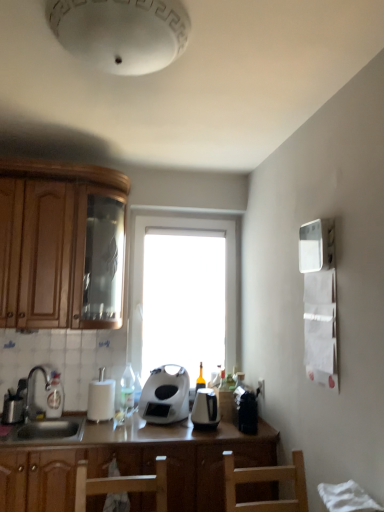
Question: Would you say white glossy bottle at center, which is the second bottle from left to right, is inside or outside transparent glass window at center?

Choices:
 (A) outside
 (B) inside

Answer: (A)

Question: Is point (132, 373) closer or farther from the camera than point (238, 229)?

Choices:
 (A) farther
 (B) closer

Answer: (B)

Question: Which is nearer to the white matte paper towel holder at center?

Choices:
 (A) wooden cabinet at left
 (B) brown wood countertop at center
 (C) white glossy bottle at center, which is the second bottle from left to right
 (D) white matte toaster at center, arranged as the 1th kitchen appliance when viewed from the left
 (E) translucent glass bottle at sink left, marked as the 2th bottle in a right-to-left arrangement

Answer: (C)

Question: Estimate the real-world distances between objects in this image. Which object is farther from the brushed metal faucet at lower left?

Choices:
 (A) white matte paper towel holder at center
 (B) brown wood countertop at center
 (C) translucent glass bottle at sink left, arranged as the 1th bottle when viewed from the left
 (D) transparent glass window at center
 (E) white glossy bottle at center, which is the second bottle from left to right

Answer: (D)